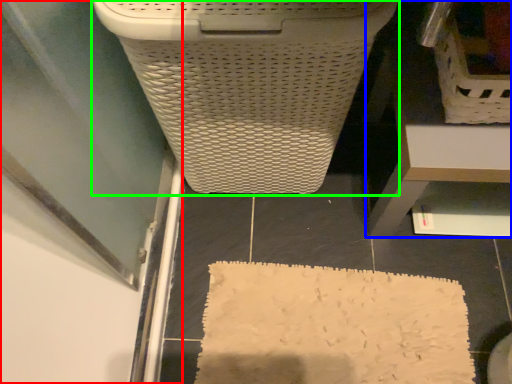
Question: Which object is the farthest from screen door (highlighted by a red box)? Choose among these: furniture (highlighted by a blue box) or waste container (highlighted by a green box).

Choices:
 (A) furniture
 (B) waste container

Answer: (A)